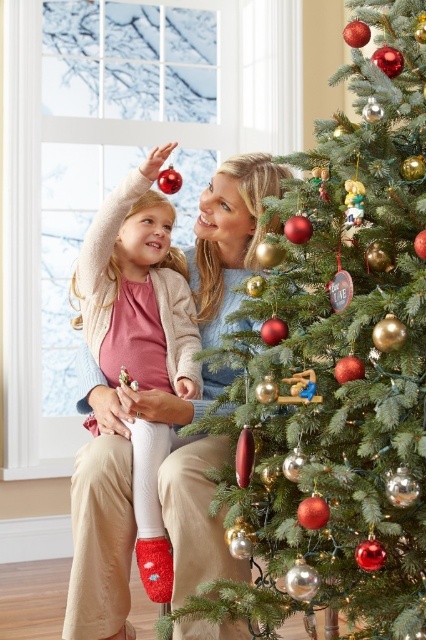
Question: Does shiny gold ornaments at right have a lesser width compared to matte pink sweater at upper left?

Choices:
 (A) yes
 (B) no

Answer: (B)

Question: In this image, where is shiny gold ornaments at right located relative to matte pink sweater at upper left?

Choices:
 (A) right
 (B) left

Answer: (A)

Question: Is shiny gold ornaments at right wider than matte pink sweater at upper left?

Choices:
 (A) no
 (B) yes

Answer: (B)

Question: Which point is closer to the camera taking this photo?

Choices:
 (A) (385, 99)
 (B) (141, 266)

Answer: (A)